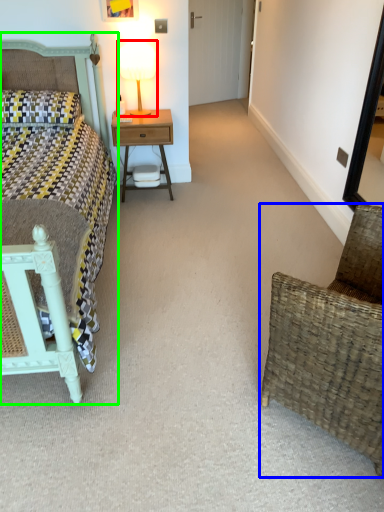
Question: Estimate the real-world distances between objects in this image. Which object is farther from bedside lamp (highlighted by a red box), chair (highlighted by a blue box) or bed (highlighted by a green box)?

Choices:
 (A) chair
 (B) bed

Answer: (A)